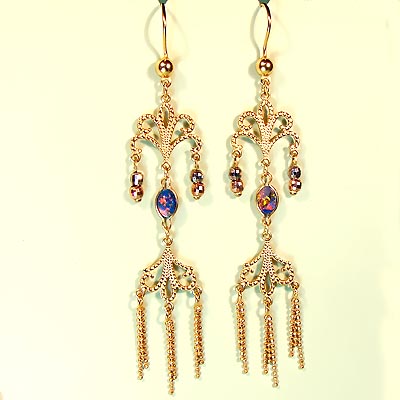
Identify the location of hook. (164, 24), (270, 24).